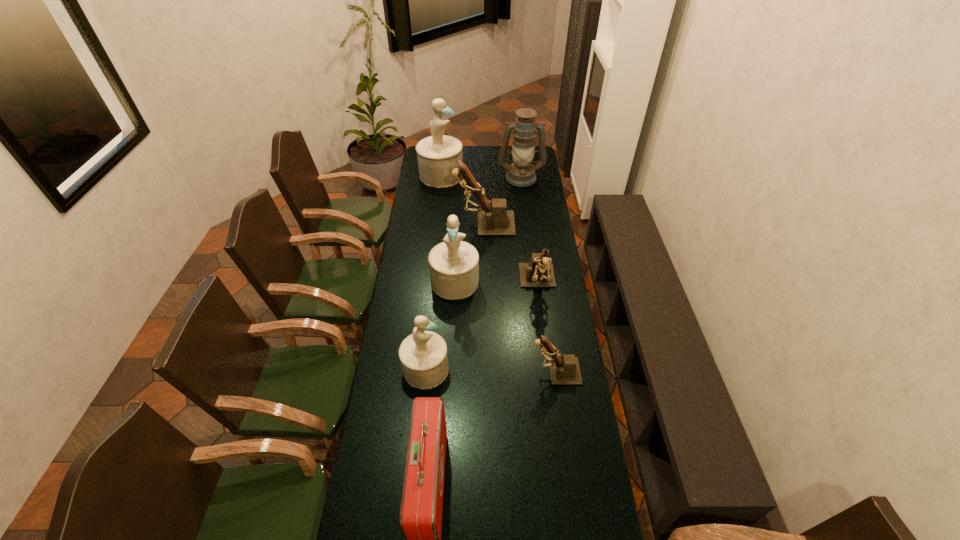
At what (x,y) coordinates should I click in order to perform the action: click on free location that satisfies the following two spatial constraints: 1. on the front-facing side of the second nearest brown figurine; 2. at the beak of the nearest white figurine. Please return your answer as a coordinate pair (x, y). Looking at the image, I should click on (548, 369).

Find the location of a particular element. This screenshot has width=960, height=540. vacant point that satisfies the following two spatial constraints: 1. at the beak of the second smallest white figurine; 2. at the beak of the nearest white figurine is located at coordinates (x=450, y=369).